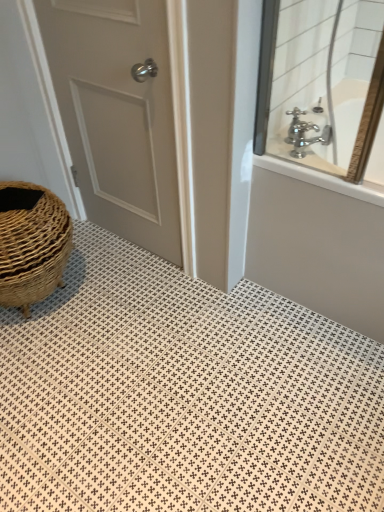
Question: From the image's perspective, is chrome metallic faucet at upper right located above or below polished chrome faucet at upper right?

Choices:
 (A) above
 (B) below

Answer: (B)

Question: In terms of size, does chrome metallic faucet at upper right appear bigger or smaller than polished chrome faucet at upper right?

Choices:
 (A) small
 (B) big

Answer: (A)

Question: Which object is the closest to the polished chrome faucet at upper right?

Choices:
 (A) white textured tile at lower left
 (B) chrome metallic faucet at upper right
 (C) silver metallic faucet at upper right
 (D) white matte door at left

Answer: (C)

Question: Which object is positioned closest to the silver metallic faucet at upper right?

Choices:
 (A) polished chrome faucet at upper right
 (B) white matte door at left
 (C) white textured tile at lower left
 (D) chrome metallic faucet at upper right

Answer: (D)